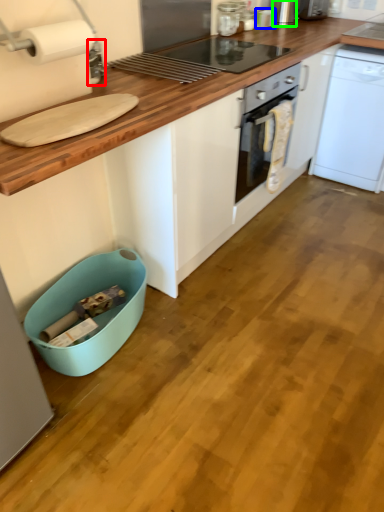
Question: Considering the real-world distances, which object is farthest from appliance (highlighted by a red box)? appliance (highlighted by a blue box) or appliance (highlighted by a green box)?

Choices:
 (A) appliance
 (B) appliance

Answer: (B)